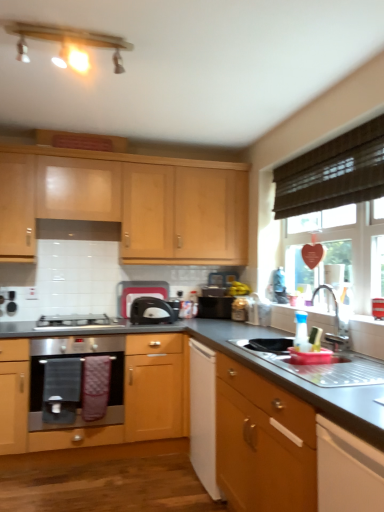
Question: Is the depth of matte wood light fixture at upper center less than that of satin black toaster at center?

Choices:
 (A) no
 (B) yes

Answer: (B)

Question: Does matte wood light fixture at upper center have a greater height compared to satin black toaster at center?

Choices:
 (A) yes
 (B) no

Answer: (B)

Question: Considering the relative positions of matte wood light fixture at upper center and satin black toaster at center in the image provided, is matte wood light fixture at upper center to the left of satin black toaster at center from the viewer's perspective?

Choices:
 (A) yes
 (B) no

Answer: (A)

Question: Considering the relative positions of matte wood light fixture at upper center and satin black toaster at center in the image provided, is matte wood light fixture at upper center to the right of satin black toaster at center from the viewer's perspective?

Choices:
 (A) no
 (B) yes

Answer: (A)

Question: Is matte wood light fixture at upper center surrounding satin black toaster at center?

Choices:
 (A) no
 (B) yes

Answer: (A)

Question: Considering the relative positions of matte wood light fixture at upper center and satin black toaster at center in the image provided, is matte wood light fixture at upper center behind satin black toaster at center?

Choices:
 (A) no
 (B) yes

Answer: (A)

Question: Is black fabric screen door at lower left oriented away from black plastic toaster at center, arranged as the second appliance when viewed from the right?

Choices:
 (A) no
 (B) yes

Answer: (A)

Question: Considering the relative positions of black fabric screen door at lower left and black plastic toaster at center, arranged as the second appliance when viewed from the right, in the image provided, is black fabric screen door at lower left to the left of black plastic toaster at center, arranged as the second appliance when viewed from the right, from the viewer's perspective?

Choices:
 (A) no
 (B) yes

Answer: (B)

Question: From a real-world perspective, is black fabric screen door at lower left on top of black plastic toaster at center, arranged as the first appliance when viewed from the left?

Choices:
 (A) yes
 (B) no

Answer: (B)

Question: Is black fabric screen door at lower left further to the viewer compared to black plastic toaster at center, arranged as the first appliance when viewed from the left?

Choices:
 (A) yes
 (B) no

Answer: (B)

Question: From the image's perspective, is black fabric screen door at lower left beneath black plastic toaster at center, arranged as the first appliance when viewed from the left?

Choices:
 (A) yes
 (B) no

Answer: (A)

Question: Is black fabric screen door at lower left thinner than black plastic toaster at center, arranged as the first appliance when viewed from the left?

Choices:
 (A) yes
 (B) no

Answer: (A)

Question: From a real-world perspective, is satin black toaster at center physically above silver metallic faucet at sink right?

Choices:
 (A) no
 (B) yes

Answer: (A)